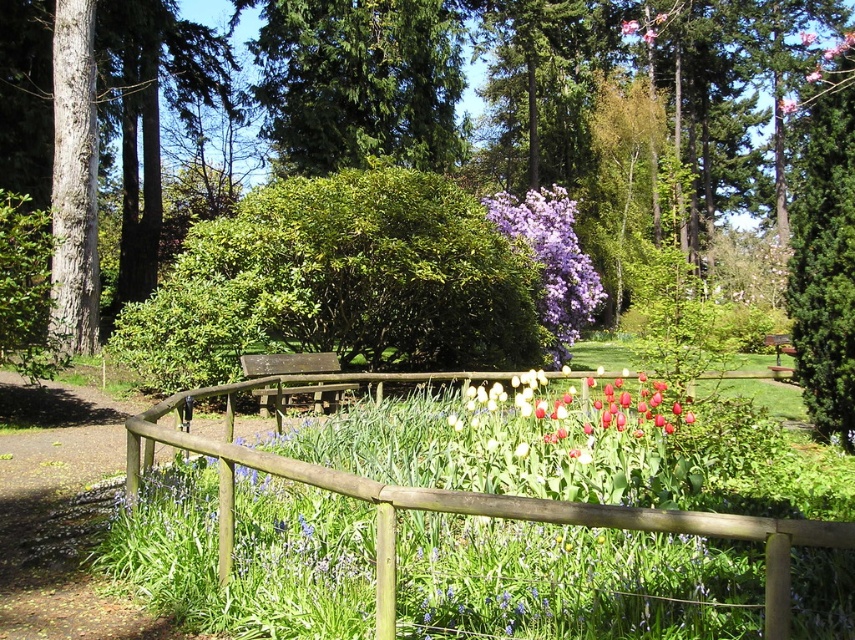
You are planning to set up a small picnic area in the park and want to place a picnic blanket between the green leafy bush at center and the green textured tree at upper center. The blanket requires a space of 8 meters between the two objects to be placed comfortably. Based on the description, will there be enough space between them?

The green leafy bush at center and the green textured tree at upper center are 9.61 meters apart, which is more than the required 8 meters. Therefore, there is enough space to place the picnic blanket comfortably between them.

You are planning to place a small garden ornament between the green leafy bush at center and the green textured tree at upper center. Based on their sizes, which object should you place it closer to for better visibility?

The green leafy bush at center is bigger than the green textured tree at upper center, so placing the ornament closer to the smaller green textured tree at upper center would ensure better visibility.